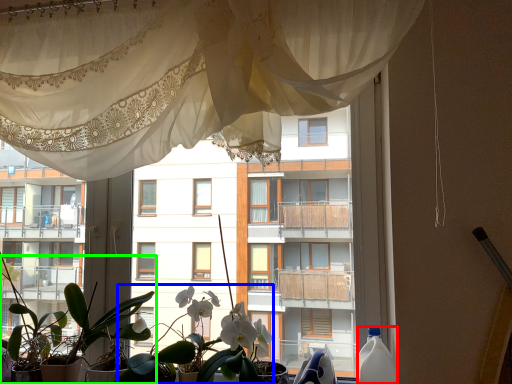
Question: Based on their relative distances, which object is farther from bottle (highlighted by a red box)? Choose from floral arrangement (highlighted by a blue box) and houseplant (highlighted by a green box).

Choices:
 (A) floral arrangement
 (B) houseplant

Answer: (B)